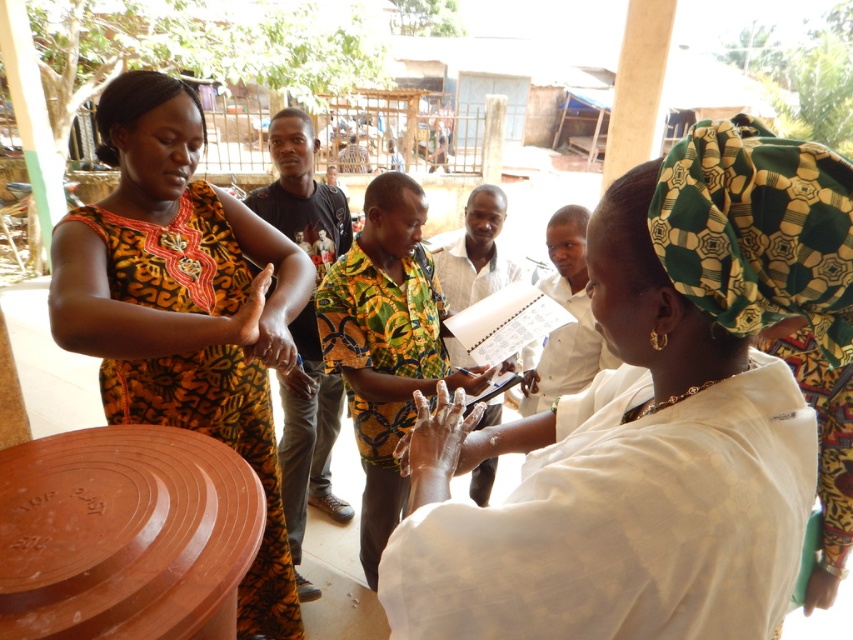
You are a photographer setting up for a group photo. You need to position the brown clay plate at center and the printed fabric dress at left so that they are exactly 24 inches apart. Based on the current arrangement, will you need to move them closer or farther apart to achieve the desired distance?

The brown clay plate at center and printed fabric dress at left are currently 27.35 inches apart. To reach the desired 24 inches, you need to move them closer together by approximately 3.35 inches.

Based on the scene description, where is the brown clay plate at center located in the image?

The brown clay plate at center is located at point (125, 534).

You are a photographer standing at a certain position and want to capture both the point at coordinates point (228,522) and point (730,296) in your photo. Which point should you focus on first to ensure both are in focus?

You should focus on point (228,522) first because it is closer to the camera than point (730,296). By focusing on the closer point, the farther point will also be in focus due to the depth of field.